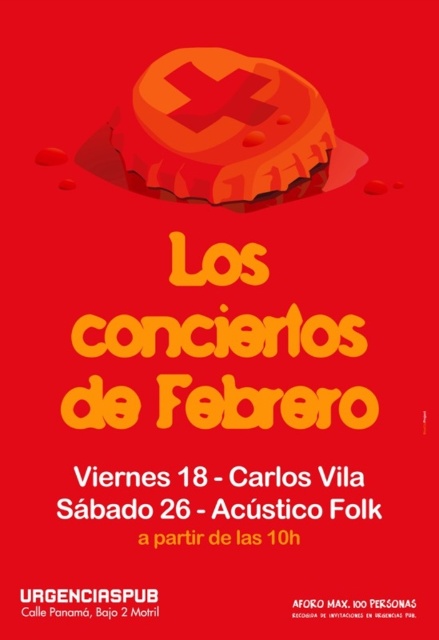
Question: Which point appears closest to the camera in this image?

Choices:
 (A) coord(384,609)
 (B) coord(191,115)

Answer: (A)

Question: Is white paper text at center bigger than white paper at center?

Choices:
 (A) yes
 (B) no

Answer: (A)

Question: Considering the real-world distances, which object is closest to the white paper text at center?

Choices:
 (A) white paper at center
 (B) matte plastic bottle cap at upper center

Answer: (A)

Question: Can you confirm if matte plastic bottle cap at upper center is wider than white paper at center?

Choices:
 (A) no
 (B) yes

Answer: (B)

Question: Which object appears farthest from the camera in this image?

Choices:
 (A) matte plastic bottle cap at upper center
 (B) white paper text at center
 (C) white paper at center

Answer: (A)

Question: Is white paper text at center below white paper at center?

Choices:
 (A) no
 (B) yes

Answer: (A)